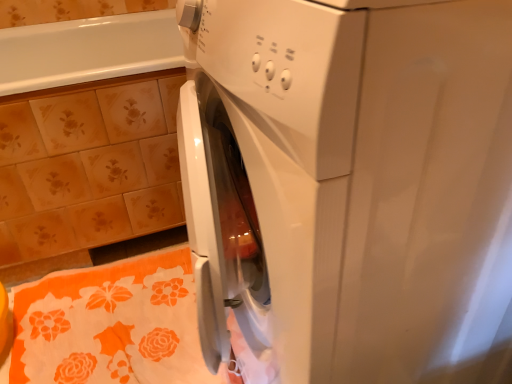
Question: From the image's perspective, does orange floral bath towel at lower left appear higher than white glossy washing machine at center?

Choices:
 (A) no
 (B) yes

Answer: (A)

Question: From a real-world perspective, is orange floral bath towel at lower left beneath white glossy washing machine at center?

Choices:
 (A) yes
 (B) no

Answer: (A)

Question: Is orange floral bath towel at lower left aimed at white glossy washing machine at center?

Choices:
 (A) no
 (B) yes

Answer: (A)

Question: Is orange floral bath towel at lower left thinner than white glossy washing machine at center?

Choices:
 (A) no
 (B) yes

Answer: (B)

Question: Is the depth of orange floral bath towel at lower left greater than that of white glossy washing machine at center?

Choices:
 (A) no
 (B) yes

Answer: (B)

Question: Is white glossy washing machine at center a part of orange floral bath towel at lower left?

Choices:
 (A) yes
 (B) no

Answer: (B)

Question: Is floral ceramic tile at upper left to the left of orange floral bath towel at lower left from the viewer's perspective?

Choices:
 (A) no
 (B) yes

Answer: (B)

Question: Is floral ceramic tile at upper left facing towards orange floral bath towel at lower left?

Choices:
 (A) yes
 (B) no

Answer: (A)

Question: Would you say floral ceramic tile at upper left is a long distance from orange floral bath towel at lower left?

Choices:
 (A) yes
 (B) no

Answer: (B)

Question: From a real-world perspective, is floral ceramic tile at upper left located beneath orange floral bath towel at lower left?

Choices:
 (A) no
 (B) yes

Answer: (A)

Question: From the image's perspective, is floral ceramic tile at upper left over orange floral bath towel at lower left?

Choices:
 (A) yes
 (B) no

Answer: (A)

Question: Is floral ceramic tile at upper left positioned before orange floral bath towel at lower left?

Choices:
 (A) no
 (B) yes

Answer: (A)

Question: Can you confirm if white glossy washing machine at center is bigger than floral ceramic tile at upper left?

Choices:
 (A) no
 (B) yes

Answer: (A)